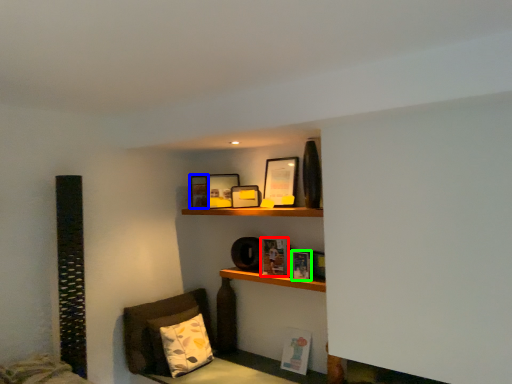
Question: Which object is the farthest from book (highlighted by a red box)? Choose among these: picture frame (highlighted by a blue box) or book (highlighted by a green box).

Choices:
 (A) picture frame
 (B) book

Answer: (A)